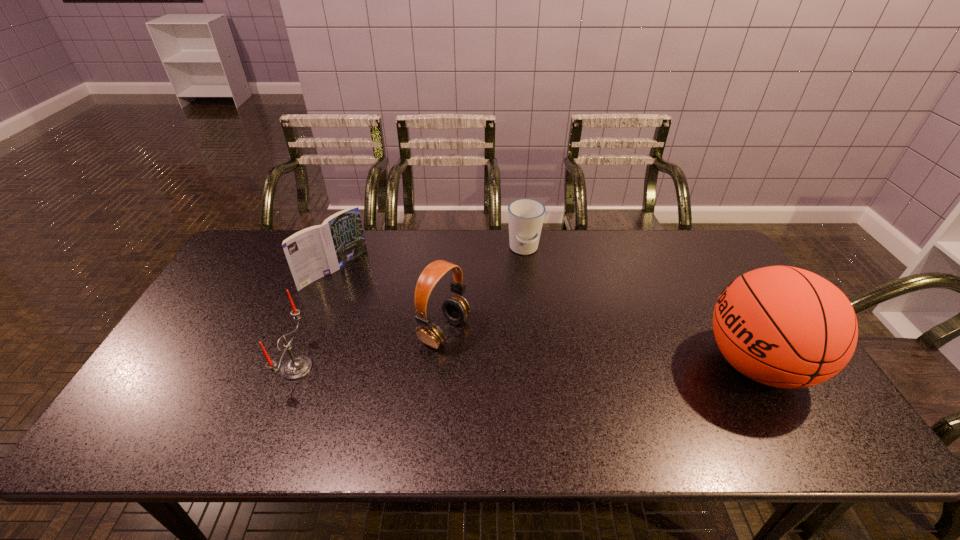
What are the coordinates of `free point located on the side with logo of the basketball` in the screenshot? It's located at (550, 364).

The width and height of the screenshot is (960, 540). I want to click on free space located 0.050m on the side with logo of the basketball, so click(682, 364).

The image size is (960, 540). I want to click on free region located 0.260m with a handle on the side of the cup, so click(x=526, y=319).

In order to click on free space located with a handle on the side of the cup in this screenshot , I will do `click(527, 349)`.

Where is `free region located 0.390m with a handle on the side of the cup`? This screenshot has height=540, width=960. free region located 0.390m with a handle on the side of the cup is located at coordinates (527, 355).

The image size is (960, 540). I want to click on free space located 0.190m on the ear cups of the third object from left to right, so click(527, 375).

Locate an element on the screen. This screenshot has width=960, height=540. vacant space located on the ear cups of the third object from left to right is located at coordinates (531, 377).

You are a GUI agent. You are given a task and a screenshot of the screen. Output one action in this format:
    pyautogui.click(x=<x>, y=<y>)
    Task: Click on the free space located 0.200m on the ear cups of the third object from left to right
    This screenshot has height=540, width=960.
    Given the screenshot: What is the action you would take?
    pyautogui.click(x=531, y=377)

The height and width of the screenshot is (540, 960). What are the coordinates of `free region located on the front cover of the book` in the screenshot? It's located at (371, 299).

Find the location of a particular element. free spot located 0.290m on the front cover of the book is located at coordinates (413, 330).